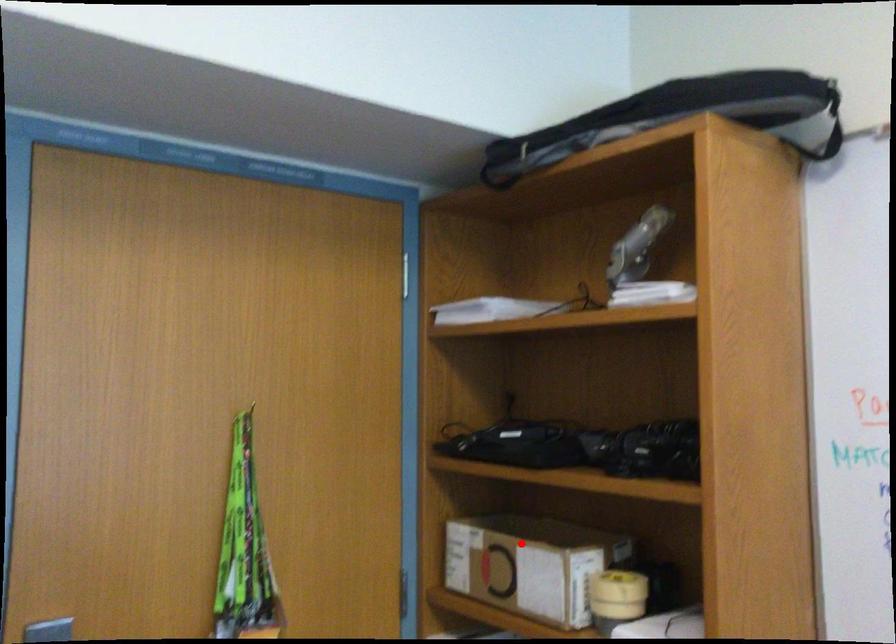
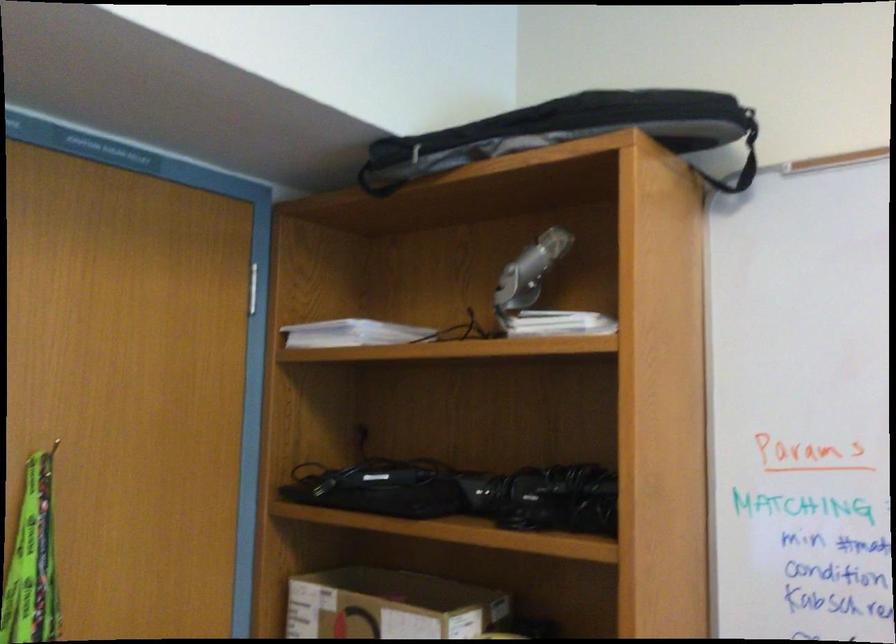
Locate, in the second image, the point that corresponds to the highlighted location in the first image.

(389, 605)